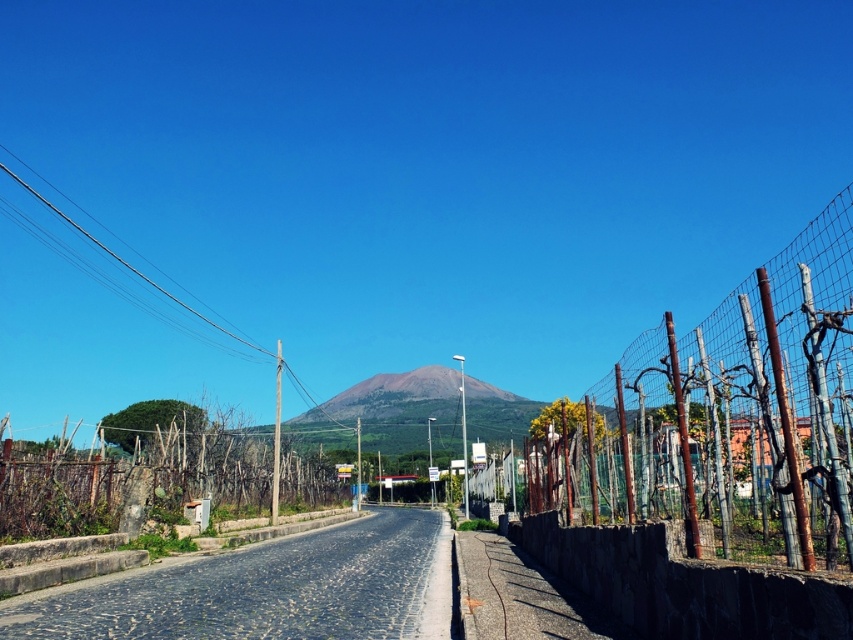
Question: Is rusty wire mesh fence at right above wire mesh fence at center?

Choices:
 (A) yes
 (B) no

Answer: (A)

Question: Is rusty wire mesh fence at right positioned behind wire mesh fence at center?

Choices:
 (A) no
 (B) yes

Answer: (A)

Question: Among these points, which one is nearest to the camera?

Choices:
 (A) pyautogui.click(x=102, y=476)
 (B) pyautogui.click(x=665, y=468)

Answer: (B)

Question: Which object is farther from the camera taking this photo?

Choices:
 (A) rusty wire mesh fence at right
 (B) wire mesh fence at center

Answer: (B)

Question: Which of the following is the closest to the observer?

Choices:
 (A) (721, 346)
 (B) (170, 515)

Answer: (A)

Question: Observing the image, what is the correct spatial positioning of rusty wire mesh fence at right in reference to wire mesh fence at center?

Choices:
 (A) below
 (B) above

Answer: (B)